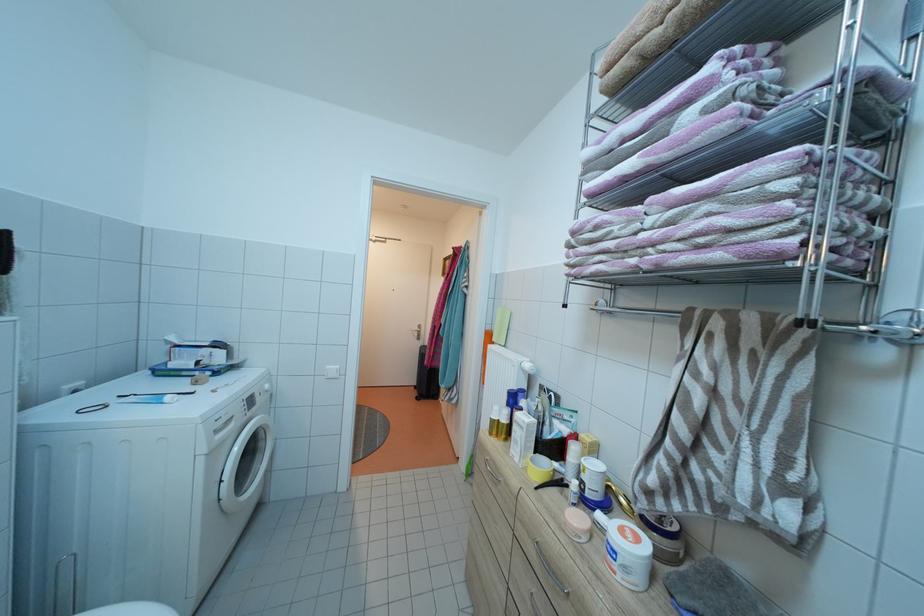
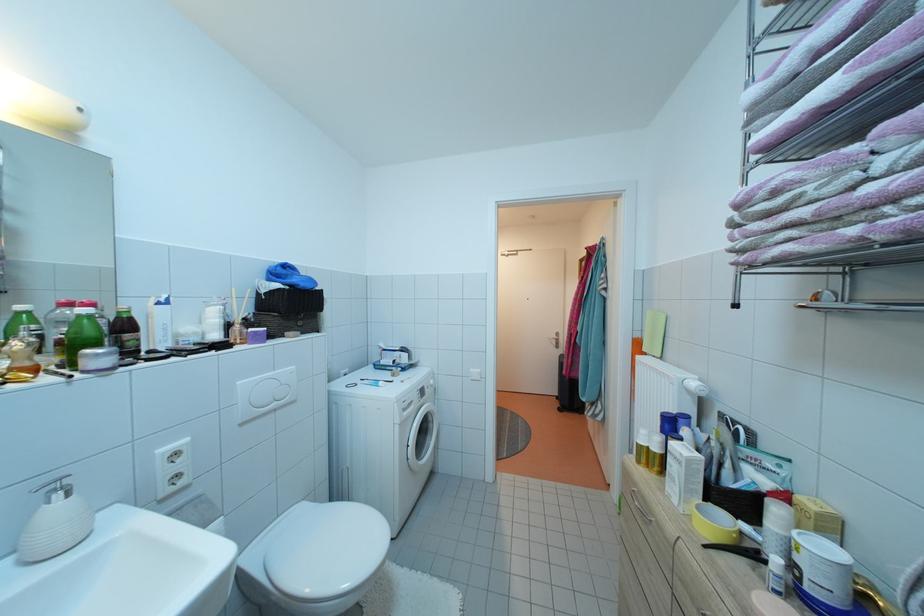
Locate, in the second image, the point that corresponds to (x=590, y=483) in the first image.

(805, 565)